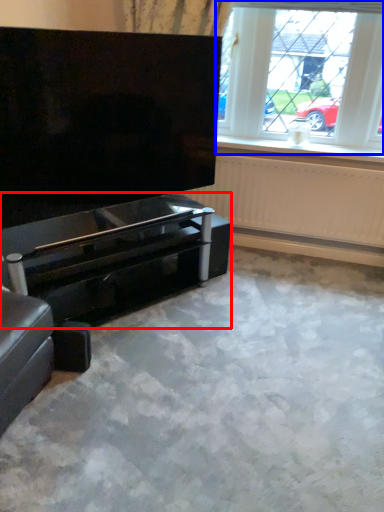
Question: Which object appears farthest to the camera in this image, piano (highlighted by a red box) or window (highlighted by a blue box)?

Choices:
 (A) piano
 (B) window

Answer: (B)